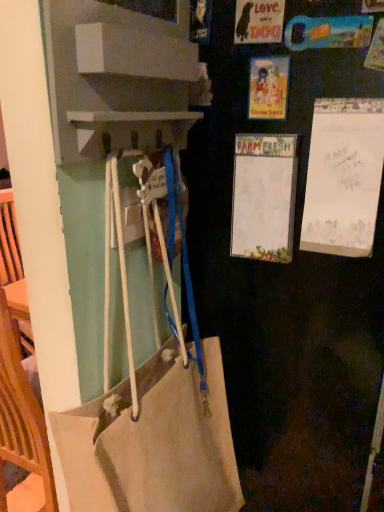
Question: Should I look upward or downward to see canvas tote bag at center?

Choices:
 (A) up
 (B) down

Answer: (B)